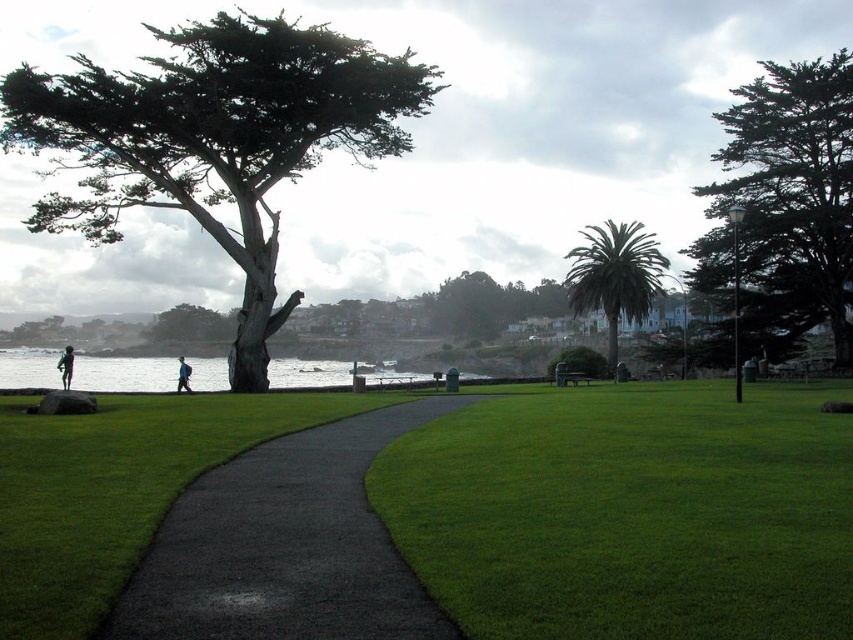
You are standing on the black asphalt path at center and want to reach the green leafy palm tree at center. Which direction should you move to get there?

The black asphalt path at center is located below the green leafy palm tree at center, so you should move upward to reach the green leafy palm tree at center.

Looking at this image, you are standing at the green textured tree at left and want to walk to the ocean. How many steps do you think it would take if each step covers about 3 feet?

The distance between the green textured tree at left and the ocean is 89.16 feet. Since each step covers about 3 feet, dividing 89.16 by 3 gives approximately 29.72 steps. Therefore, it would take around 30 steps to reach the ocean from the green textured tree at left.

You are standing on the paved pathway in the coastal park and want to take a photo of both the green textured tree at left and the green textured tree at right. Based on their positions, which tree appears closer to the ground?

The green textured tree at left appears closer to the ground because it is positioned below the green textured tree at right.